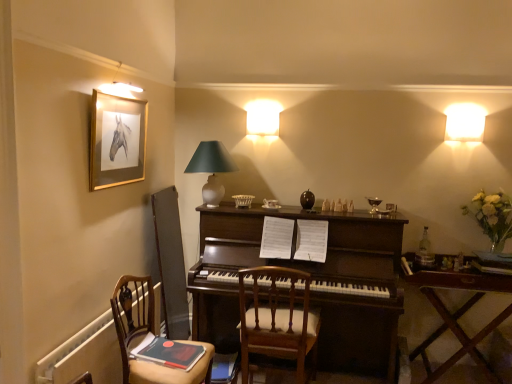
Question: From a real-world perspective, is matte white lampshade at center positioned above or below wooden chair at center, acting as the 1th chair starting from the right?

Choices:
 (A) above
 (B) below

Answer: (A)

Question: From the image's perspective, is matte white lampshade at center above or below wooden chair at center, acting as the 1th chair starting from the right?

Choices:
 (A) below
 (B) above

Answer: (B)

Question: Which object is the closest to the gold-framed picture at upper left?

Choices:
 (A) matte white lampshade at center
 (B) wooden chair at center, acting as the 1th chair starting from the right
 (C) white frosted glass lampshade at upper right
 (D) wooden table at right
 (E) dark wood piano at center

Answer: (A)

Question: Which object is the farthest from the dark wood piano at center?

Choices:
 (A) matte white lampshade at center
 (B) wooden chair at center, acting as the 1th chair starting from the right
 (C) wooden chair at lower left, the first chair viewed from the left
 (D) gold-framed picture at upper left
 (E) wooden table at right

Answer: (D)